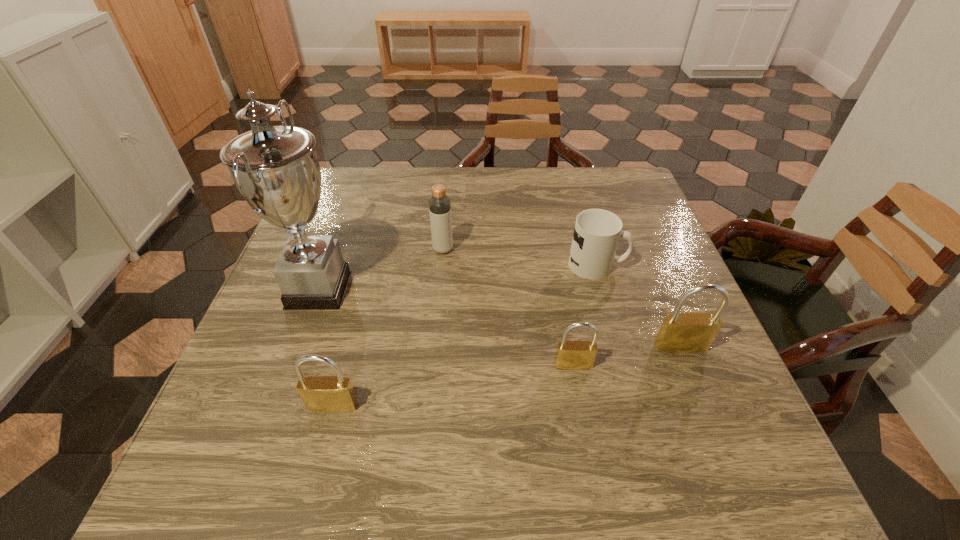
Where is `the nearest padlock`? The width and height of the screenshot is (960, 540). the nearest padlock is located at coordinates (327, 394).

The height and width of the screenshot is (540, 960). I want to click on the leftmost padlock, so click(x=327, y=394).

Find the location of a particular element. the second padlock from left to right is located at coordinates (570, 355).

Find the location of `the shortest padlock`. the shortest padlock is located at coordinates (570, 355).

Find the location of a particular element. Image resolution: width=960 pixels, height=540 pixels. the rightmost padlock is located at coordinates (691, 332).

What are the coordinates of `the third nearest object` in the screenshot? It's located at (691, 332).

Where is `bottle`? This screenshot has width=960, height=540. bottle is located at coordinates (439, 203).

Locate an element on the screen. This screenshot has height=540, width=960. mug is located at coordinates (597, 232).

Where is `the tallest object`? Image resolution: width=960 pixels, height=540 pixels. the tallest object is located at coordinates (275, 168).

Find the location of a particular element. This screenshot has width=960, height=540. free space located 0.100m on the front-facing side of the second nearest padlock is located at coordinates (583, 418).